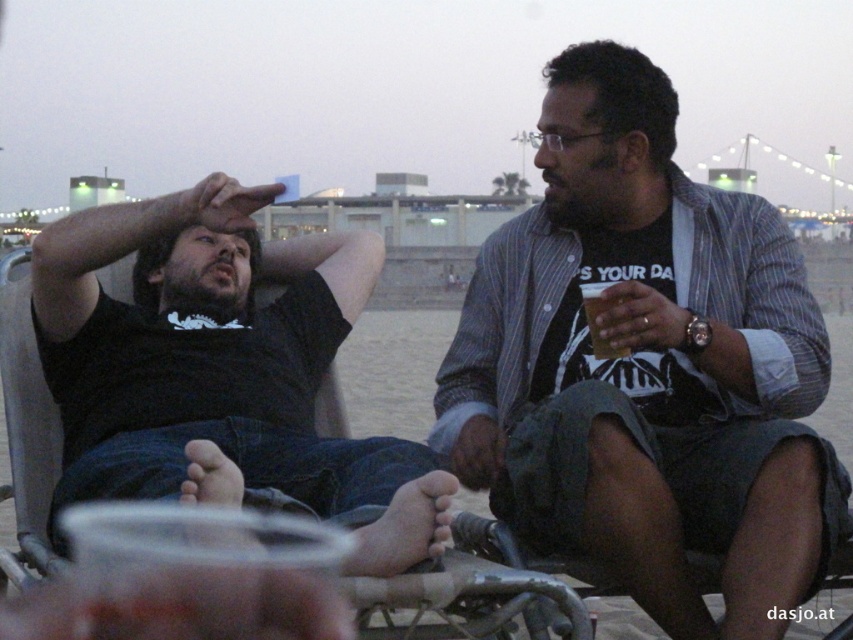
Question: From the image, what is the correct spatial relationship of black matte shirt at left in relation to translucent plastic cup at right?

Choices:
 (A) right
 (B) left

Answer: (B)

Question: Which point is closer to the camera?

Choices:
 (A) black matte shirt at left
 (B) translucent plastic cup at right
 (C) matte black shirt at center

Answer: (A)

Question: Can you confirm if matte black shirt at center is positioned above translucent plastic cup at right?

Choices:
 (A) yes
 (B) no

Answer: (B)

Question: Which of the following is the farthest from the observer?

Choices:
 (A) (659, 397)
 (B) (212, 456)
 (C) (602, 282)

Answer: (C)

Question: Is matte black shirt at center above black matte shirt at left?

Choices:
 (A) yes
 (B) no

Answer: (B)

Question: Which point is farther from the camera taking this photo?

Choices:
 (A) (610, 349)
 (B) (314, 237)
 (C) (751, 388)

Answer: (B)